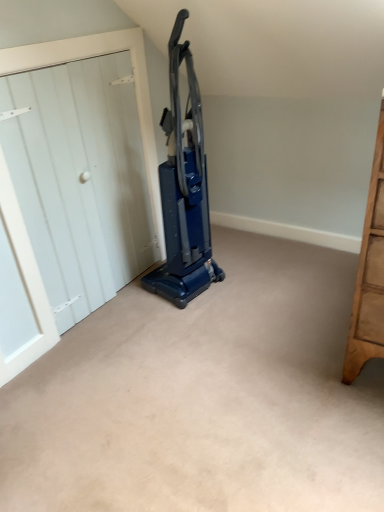
This screenshot has height=512, width=384. Identify the location of free spot in front of white wood door at left. (130, 355).